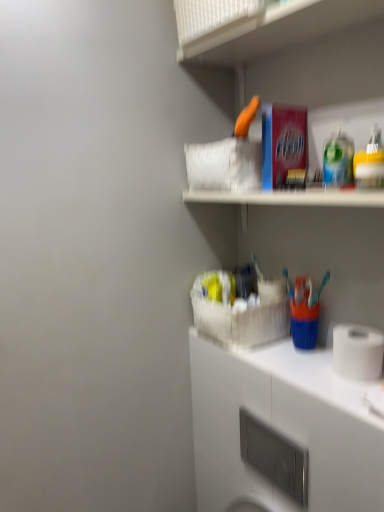
Question: Is white matte cabinet at lower right taller than satin nickel soap dispenser at lower center?

Choices:
 (A) no
 (B) yes

Answer: (A)

Question: Does white matte cabinet at lower right have a lesser width compared to satin nickel soap dispenser at lower center?

Choices:
 (A) yes
 (B) no

Answer: (B)

Question: Does white matte cabinet at lower right come behind satin nickel soap dispenser at lower center?

Choices:
 (A) yes
 (B) no

Answer: (B)

Question: Is white matte cabinet at lower right positioned in front of satin nickel soap dispenser at lower center?

Choices:
 (A) no
 (B) yes

Answer: (B)

Question: Can you confirm if white matte cabinet at lower right is smaller than satin nickel soap dispenser at lower center?

Choices:
 (A) yes
 (B) no

Answer: (A)

Question: From a real-world perspective, is white plastic basket at upper center above or below satin nickel soap dispenser at lower center?

Choices:
 (A) below
 (B) above

Answer: (B)

Question: Considering the positions of point (x=230, y=31) and point (x=279, y=464), is point (x=230, y=31) closer or farther from the camera than point (x=279, y=464)?

Choices:
 (A) farther
 (B) closer

Answer: (B)

Question: In terms of width, does white plastic basket at upper center look wider or thinner when compared to satin nickel soap dispenser at lower center?

Choices:
 (A) wide
 (B) thin

Answer: (A)

Question: Relative to satin nickel soap dispenser at lower center, is white plastic basket at upper center in front or behind?

Choices:
 (A) behind
 (B) front

Answer: (B)

Question: Do you think white matte cabinet at lower right is within white matte toilet paper at lower right, or outside of it?

Choices:
 (A) outside
 (B) inside

Answer: (A)

Question: From a real-world perspective, is white matte cabinet at lower right positioned above or below white matte toilet paper at lower right?

Choices:
 (A) below
 (B) above

Answer: (A)

Question: Considering the positions of white matte cabinet at lower right and white matte toilet paper at lower right in the image, is white matte cabinet at lower right wider or thinner than white matte toilet paper at lower right?

Choices:
 (A) wide
 (B) thin

Answer: (A)

Question: In terms of height, does white matte cabinet at lower right look taller or shorter compared to white matte toilet paper at lower right?

Choices:
 (A) tall
 (B) short

Answer: (B)

Question: Considering the positions of satin nickel soap dispenser at lower center and white matte cabinet at lower right in the image, is satin nickel soap dispenser at lower center bigger or smaller than white matte cabinet at lower right?

Choices:
 (A) big
 (B) small

Answer: (A)

Question: Visually, is satin nickel soap dispenser at lower center positioned to the left or to the right of white matte cabinet at lower right?

Choices:
 (A) right
 (B) left

Answer: (B)